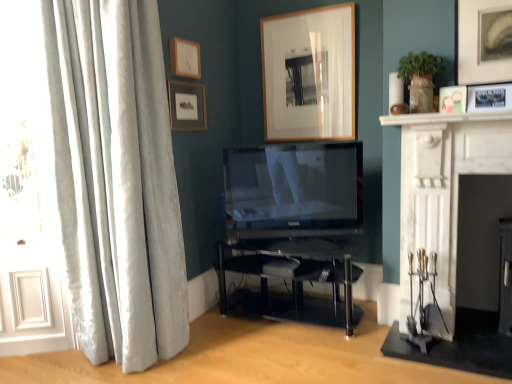
Question: Is matte wood picture frame at upper center, arranged as the 4th picture frame when viewed from the right, aimed at wooden picture frame at upper center, which ranks as the third picture frame in left-to-right order?

Choices:
 (A) no
 (B) yes

Answer: (A)

Question: Is matte wood picture frame at upper center, arranged as the 4th picture frame when viewed from the right, at the right side of wooden picture frame at upper center, which appears as the 3th picture frame when viewed from the right?

Choices:
 (A) no
 (B) yes

Answer: (A)

Question: From the image's perspective, is matte wood picture frame at upper center, arranged as the 4th picture frame when viewed from the right, beneath wooden picture frame at upper center, which ranks as the third picture frame in left-to-right order?

Choices:
 (A) yes
 (B) no

Answer: (B)

Question: Considering the relative sizes of matte wood picture frame at upper center, the 2th picture frame viewed from the left, and wooden picture frame at upper center, which ranks as the third picture frame in left-to-right order, in the image provided, is matte wood picture frame at upper center, the 2th picture frame viewed from the left, smaller than wooden picture frame at upper center, which ranks as the third picture frame in left-to-right order,?

Choices:
 (A) no
 (B) yes

Answer: (B)

Question: Considering the relative sizes of matte wood picture frame at upper center, arranged as the 4th picture frame when viewed from the right, and wooden picture frame at upper center, which ranks as the third picture frame in left-to-right order, in the image provided, is matte wood picture frame at upper center, arranged as the 4th picture frame when viewed from the right, shorter than wooden picture frame at upper center, which ranks as the third picture frame in left-to-right order,?

Choices:
 (A) yes
 (B) no

Answer: (A)

Question: Considering the positions of matte white picture frame at upper right, which ranks as the 1th picture frame in right-to-left order, and silky white curtains at left in the image, is matte white picture frame at upper right, which ranks as the 1th picture frame in right-to-left order, taller or shorter than silky white curtains at left?

Choices:
 (A) short
 (B) tall

Answer: (A)

Question: Based on their positions, is matte white picture frame at upper right, which ranks as the 5th picture frame in left-to-right order, located to the left or right of silky white curtains at left?

Choices:
 (A) left
 (B) right

Answer: (B)

Question: Relative to silky white curtains at left, is matte white picture frame at upper right, which ranks as the 5th picture frame in left-to-right order, in front or behind?

Choices:
 (A) front
 (B) behind

Answer: (B)

Question: Considering the positions of point (504, 84) and point (58, 180), is point (504, 84) closer or farther from the camera than point (58, 180)?

Choices:
 (A) farther
 (B) closer

Answer: (B)

Question: Is matte wooden picture frame at upper left, arranged as the 5th picture frame when viewed from the right, taller or shorter than white marble fireplace at upper right?

Choices:
 (A) tall
 (B) short

Answer: (A)

Question: In the image, is matte wooden picture frame at upper left, which is counted as the first picture frame, starting from the left, positioned in front of or behind white marble fireplace at upper right?

Choices:
 (A) behind
 (B) front

Answer: (A)

Question: Considering the positions of matte wooden picture frame at upper left, which is counted as the first picture frame, starting from the left, and white marble fireplace at upper right in the image, is matte wooden picture frame at upper left, which is counted as the first picture frame, starting from the left, bigger or smaller than white marble fireplace at upper right?

Choices:
 (A) big
 (B) small

Answer: (B)

Question: Is point (196, 122) closer or farther from the camera than point (496, 119)?

Choices:
 (A) farther
 (B) closer

Answer: (A)

Question: From their relative heights in the image, would you say white marble fireplace at upper right is taller or shorter than wooden picture frame at upper center, which appears as the 3th picture frame when viewed from the right?

Choices:
 (A) short
 (B) tall

Answer: (A)

Question: Is white marble fireplace at upper right bigger or smaller than wooden picture frame at upper center, which ranks as the third picture frame in left-to-right order?

Choices:
 (A) small
 (B) big

Answer: (A)